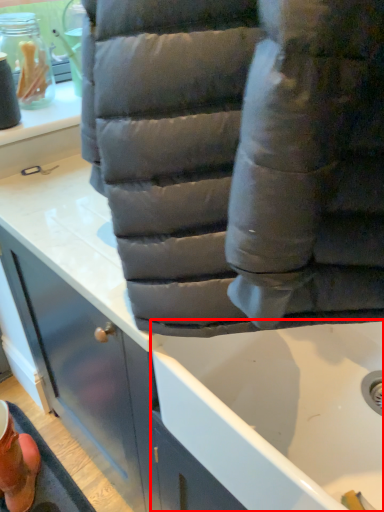
Question: From the image's perspective, what is the correct spatial positioning of bath (annotated by the red box) in reference to footwear?

Choices:
 (A) above
 (B) below

Answer: (A)